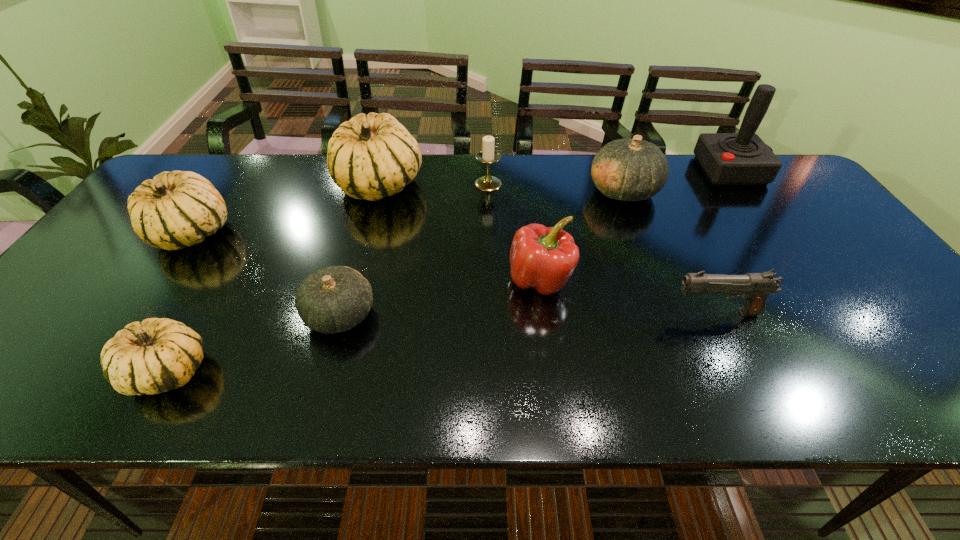
Identify the location of object that is at the near edge. (156, 355).

Identify the location of object that is at the left edge. The width and height of the screenshot is (960, 540). (176, 209).

At what (x,y) coordinates should I click in order to perform the action: click on object that is at the right edge. Please return your answer as a coordinate pair (x, y). Looking at the image, I should click on (742, 158).

The image size is (960, 540). Identify the location of object that is at the far right corner. (742, 158).

Where is `vacant area at the far edge of the desktop`? The height and width of the screenshot is (540, 960). vacant area at the far edge of the desktop is located at coordinates (318, 156).

At what (x,y) coordinates should I click in order to perform the action: click on vacant area at the near edge. Please return your answer as a coordinate pair (x, y). Image resolution: width=960 pixels, height=540 pixels. Looking at the image, I should click on (523, 379).

Identify the location of vacant area at the left edge of the desktop. (36, 340).

Where is `vacant area at the right edge`? The height and width of the screenshot is (540, 960). vacant area at the right edge is located at coordinates (825, 214).

The height and width of the screenshot is (540, 960). I want to click on free space at the near left corner of the desktop, so click(35, 394).

Find the location of a particular element. This screenshot has width=960, height=540. vacant point located between the joystick and the gun is located at coordinates pos(723,241).